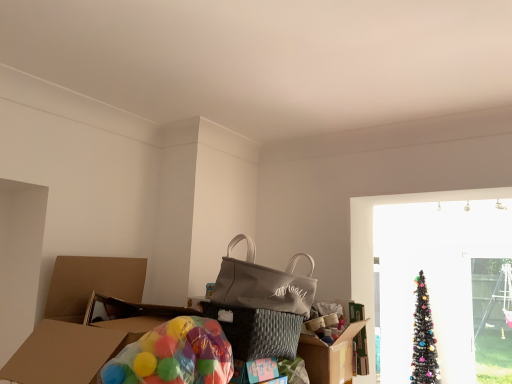
Question: Should I look upward or downward to see translucent plastic balloons at lower left?

Choices:
 (A) down
 (B) up

Answer: (A)

Question: Can you see matte gray tote bag at center touching black glittery christmas tree at right?

Choices:
 (A) yes
 (B) no

Answer: (B)

Question: Is black glittery christmas tree at right surrounded by matte gray tote bag at center?

Choices:
 (A) yes
 (B) no

Answer: (B)

Question: Is matte gray tote bag at center turned away from black glittery christmas tree at right?

Choices:
 (A) yes
 (B) no

Answer: (B)

Question: Is matte gray tote bag at center aimed at black glittery christmas tree at right?

Choices:
 (A) no
 (B) yes

Answer: (A)

Question: Can you confirm if matte gray tote bag at center is smaller than black glittery christmas tree at right?

Choices:
 (A) yes
 (B) no

Answer: (A)

Question: Does matte gray tote bag at center lie behind black glittery christmas tree at right?

Choices:
 (A) yes
 (B) no

Answer: (B)

Question: Considering the relative sizes of black glittery christmas tree at right and translucent plastic balloons at lower left in the image provided, is black glittery christmas tree at right shorter than translucent plastic balloons at lower left?

Choices:
 (A) yes
 (B) no

Answer: (B)

Question: Is black glittery christmas tree at right at the left side of translucent plastic balloons at lower left?

Choices:
 (A) yes
 (B) no

Answer: (B)

Question: Does black glittery christmas tree at right have a greater height compared to translucent plastic balloons at lower left?

Choices:
 (A) no
 (B) yes

Answer: (B)

Question: From a real-world perspective, is black glittery christmas tree at right under translucent plastic balloons at lower left?

Choices:
 (A) no
 (B) yes

Answer: (B)

Question: Is black glittery christmas tree at right outside translucent plastic balloons at lower left?

Choices:
 (A) no
 (B) yes

Answer: (B)

Question: Considering the relative positions of black glittery christmas tree at right and translucent plastic balloons at lower left in the image provided, is black glittery christmas tree at right to the right of translucent plastic balloons at lower left from the viewer's perspective?

Choices:
 (A) no
 (B) yes

Answer: (B)

Question: Is translucent plastic balloons at lower left next to black glittery christmas tree at right and touching it?

Choices:
 (A) yes
 (B) no

Answer: (B)